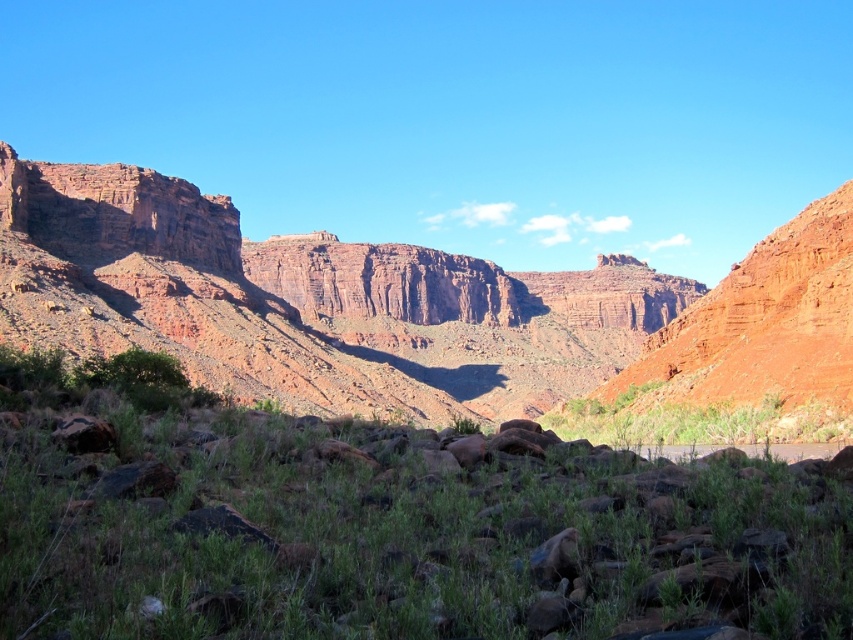
Question: Does rustic rock formation at center have a greater width compared to green leafy shrubs at center?

Choices:
 (A) yes
 (B) no

Answer: (A)

Question: Which point is farther to the camera?

Choices:
 (A) (244, 296)
 (B) (558, 417)
 (C) (312, 492)

Answer: (A)

Question: Is green grassy at center closer to the viewer compared to rustic rock formation at center?

Choices:
 (A) no
 (B) yes

Answer: (B)

Question: Which object is the farthest from the green leafy shrubs at center?

Choices:
 (A) green grassy at center
 (B) rustic rock formation at center

Answer: (B)

Question: Considering the relative positions of rustic rock formation at center and green leafy shrubs at center in the image provided, where is rustic rock formation at center located with respect to green leafy shrubs at center?

Choices:
 (A) below
 (B) above

Answer: (B)

Question: Which object appears farthest from the camera in this image?

Choices:
 (A) green leafy shrubs at center
 (B) green grassy at center

Answer: (A)